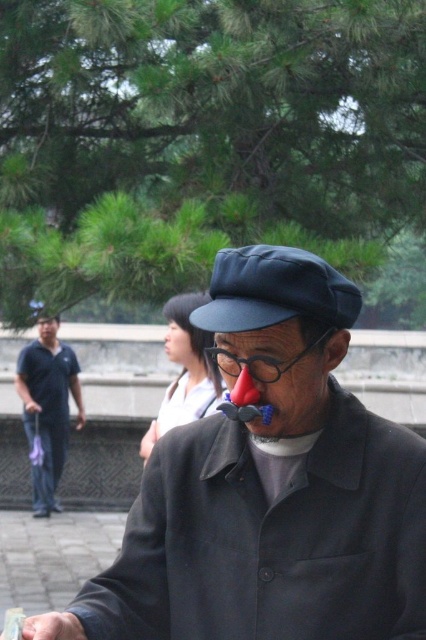
Question: Estimate the real-world distances between objects in this image. Which object is farther from the dark gray matte jacket at center?

Choices:
 (A) black fabric cap at center
 (B) matte blue jeans at left

Answer: (B)

Question: Does dark gray matte jacket at center appear on the left side of matte blue jeans at left?

Choices:
 (A) no
 (B) yes

Answer: (A)

Question: Which point is closer to the camera taking this photo?

Choices:
 (A) (46, 497)
 (B) (377, 438)

Answer: (B)

Question: Among these objects, which one is nearest to the camera?

Choices:
 (A) matte blue jeans at left
 (B) black fabric cap at center
 (C) dark gray matte jacket at center

Answer: (B)

Question: Is black fabric cap at center above matte blue jeans at left?

Choices:
 (A) no
 (B) yes

Answer: (B)

Question: Can you confirm if dark gray matte jacket at center is positioned to the left of black fabric cap at center?

Choices:
 (A) yes
 (B) no

Answer: (A)